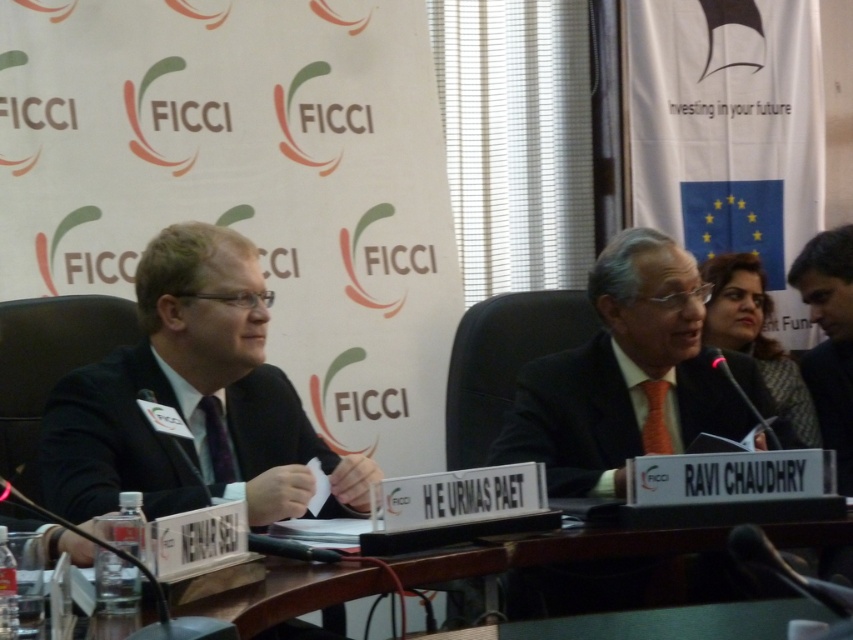
Image resolution: width=853 pixels, height=640 pixels. Describe the element at coordinates (624, 376) in the screenshot. I see `orange silk tie at center` at that location.

At what (x,y) coordinates should I click in order to perform the action: click on orange silk tie at center. Please return your answer as a coordinate pair (x, y). The width and height of the screenshot is (853, 640). Looking at the image, I should click on (624, 376).

Where is `orange silk tie at center`? This screenshot has height=640, width=853. orange silk tie at center is located at coordinates (624, 376).

Is point (103, 531) positioned in front of point (747, 291)?

Yes, it is.

Is black plastic table at lower center to the right of dark gray suit at right from the viewer's perspective?

No, black plastic table at lower center is not to the right of dark gray suit at right.

Is point (722, 531) positioned in front of point (726, 253)?

Yes, it is.

The image size is (853, 640). In order to click on black plastic table at lower center in this screenshot , I will do `click(550, 550)`.

Who is taller, orange silk tie at center or dark gray suit at right?

dark gray suit at right

Is point (688, 352) in front of point (804, 385)?

That is True.

You are a GUI agent. You are given a task and a screenshot of the screen. Output one action in this format:
    pyautogui.click(x=<x>, y=<y>)
    Task: Click on the orange silk tie at center
    This screenshot has height=640, width=853.
    Given the screenshot: What is the action you would take?
    pyautogui.click(x=624, y=376)